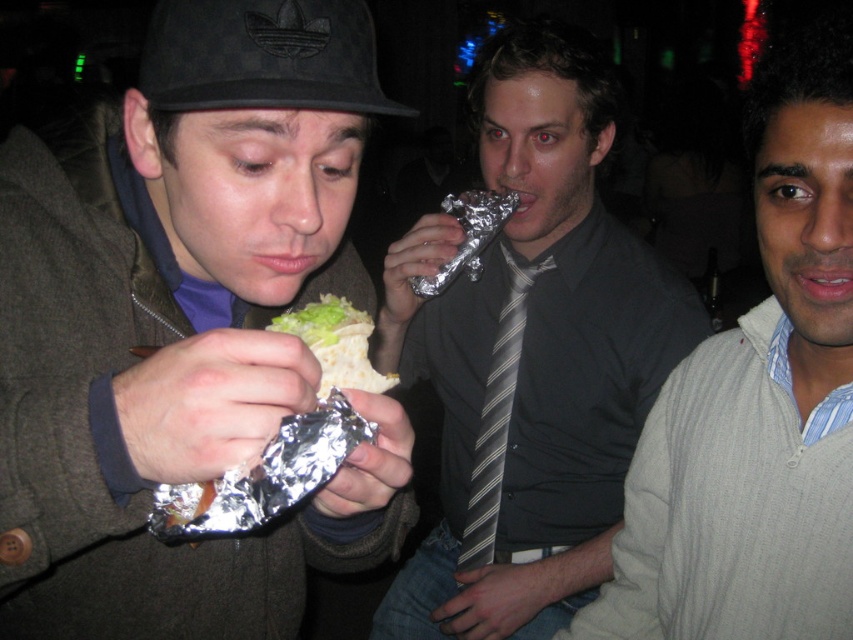
What do you see at coordinates (184, 324) in the screenshot?
I see `matte black hat at upper left` at bounding box center [184, 324].

Is matte black hat at upper left to the right of striped tie at center from the viewer's perspective?

In fact, matte black hat at upper left is to the left of striped tie at center.

Is point (187, 65) less distant than point (494, 310)?

Yes, point (187, 65) is closer to viewer.

I want to click on matte black hat at upper left, so click(184, 324).

Does black suede baseball cap at upper left have a smaller size compared to striped fabric tie at center?

Correct, black suede baseball cap at upper left occupies less space than striped fabric tie at center.

Does point (173, 10) come closer to viewer compared to point (503, 310)?

Yes, point (173, 10) is in front of point (503, 310).

I want to click on black suede baseball cap at upper left, so pyautogui.click(x=262, y=56).

Is striped tie at center positioned before green leafy lettuce at center?

That is False.

Does striped tie at center have a lesser width compared to green leafy lettuce at center?

In fact, striped tie at center might be wider than green leafy lettuce at center.

In order to click on striped tie at center in this screenshot , I will do `click(531, 355)`.